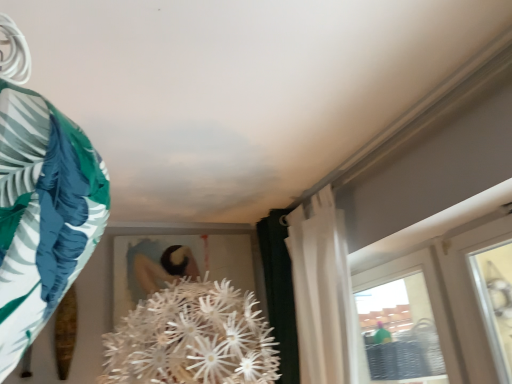
This screenshot has height=384, width=512. What do you see at coordinates (42, 214) in the screenshot?
I see `green fabric at left` at bounding box center [42, 214].

Image resolution: width=512 pixels, height=384 pixels. What are the coordinates of `green fabric at left` in the screenshot? It's located at (42, 214).

The height and width of the screenshot is (384, 512). Describe the element at coordinates (324, 295) in the screenshot. I see `white sheer curtain at upper right` at that location.

Where is `white sheer curtain at upper right`? white sheer curtain at upper right is located at coordinates (324, 295).

Where is `green fabric at left`? This screenshot has width=512, height=384. green fabric at left is located at coordinates (42, 214).

From the picture: Visually, is green fabric at left positioned to the left or to the right of white sheer curtain at upper right?

From the image, it's evident that green fabric at left is to the left of white sheer curtain at upper right.

Relative to white sheer curtain at upper right, is green fabric at left in front or behind?

Clearly, green fabric at left is in front of white sheer curtain at upper right.

Which point is more forward, (71, 158) or (321, 361)?

Positioned in front is point (71, 158).

From the image's perspective, which one is positioned higher, green fabric at left or white sheer curtain at upper right?

green fabric at left appears higher in the image.

From a real-world perspective, is green fabric at left over white sheer curtain at upper right?

Correct, in the physical world, green fabric at left is higher than white sheer curtain at upper right.

Can you confirm if green fabric at left is thinner than white sheer curtain at upper right?

Indeed, green fabric at left has a lesser width compared to white sheer curtain at upper right.

Considering the relative sizes of green fabric at left and white sheer curtain at upper right in the image provided, is green fabric at left shorter than white sheer curtain at upper right?

Correct, green fabric at left is not as tall as white sheer curtain at upper right.

Does green fabric at left have a larger size compared to white sheer curtain at upper right?

No, green fabric at left is not bigger than white sheer curtain at upper right.

Is white sheer curtain at upper right inside green fabric at left?

No, white sheer curtain at upper right is not a part of green fabric at left.

Is green fabric at left placed right next to white sheer curtain at upper right?

green fabric at left and white sheer curtain at upper right are clearly separated.

Is green fabric at left turned away from white sheer curtain at upper right?

No.

What's the angular difference between green fabric at left and white sheer curtain at upper right's facing directions?

There is a 4.58-degree angle between the facing directions of green fabric at left and white sheer curtain at upper right.

Where is `curtain that appears behind the green fabric at left`? curtain that appears behind the green fabric at left is located at coordinates (324, 295).

Considering the positions of objects white sheer curtain at upper right and green fabric at left in the image provided, who is more to the right, white sheer curtain at upper right or green fabric at left?

From the viewer's perspective, white sheer curtain at upper right appears more on the right side.

Between white sheer curtain at upper right and green fabric at left, which one is positioned behind?

Positioned behind is white sheer curtain at upper right.

Does point (308, 338) appear closer or farther from the camera than point (54, 226)?

Point (308, 338) appears to be farther away from the viewer than point (54, 226).

From the image's perspective, which one is positioned lower, white sheer curtain at upper right or green fabric at left?

white sheer curtain at upper right, from the image's perspective.

From the picture: From a real-world perspective, which is physically below, white sheer curtain at upper right or green fabric at left?

white sheer curtain at upper right.

In the scene shown: Looking at their sizes, would you say white sheer curtain at upper right is wider or thinner than green fabric at left?

white sheer curtain at upper right is wider than green fabric at left.

Does white sheer curtain at upper right have a lesser height compared to green fabric at left?

No, white sheer curtain at upper right is not shorter than green fabric at left.

Based on their sizes in the image, would you say white sheer curtain at upper right is bigger or smaller than green fabric at left?

white sheer curtain at upper right is bigger than green fabric at left.

Is white sheer curtain at upper right not inside green fabric at left?

That's correct, white sheer curtain at upper right is outside of green fabric at left.

Is there a large distance between white sheer curtain at upper right and green fabric at left?

Yes, white sheer curtain at upper right and green fabric at left are located far from each other.

Is white sheer curtain at upper right looking in the opposite direction of green fabric at left?

No, white sheer curtain at upper right is not facing the opposite direction of green fabric at left.

Find the location of a particular element. clothing in front of the white sheer curtain at upper right is located at coordinates (42, 214).

The width and height of the screenshot is (512, 384). I want to click on curtain behind the green fabric at left, so tap(324, 295).

I want to click on clothing located on the left of white sheer curtain at upper right, so click(x=42, y=214).